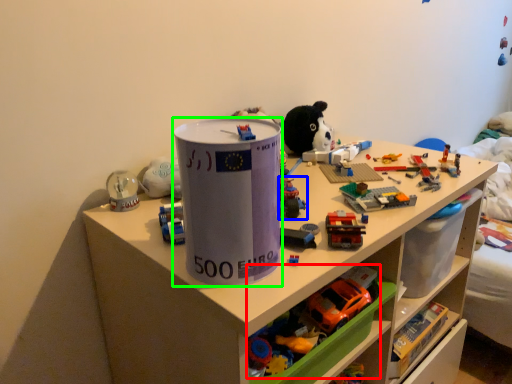
Question: Considering the real-world distances, which object is closest to toy (highlighted by a red box)? toy (highlighted by a blue box) or paper cup (highlighted by a green box).

Choices:
 (A) toy
 (B) paper cup

Answer: (A)